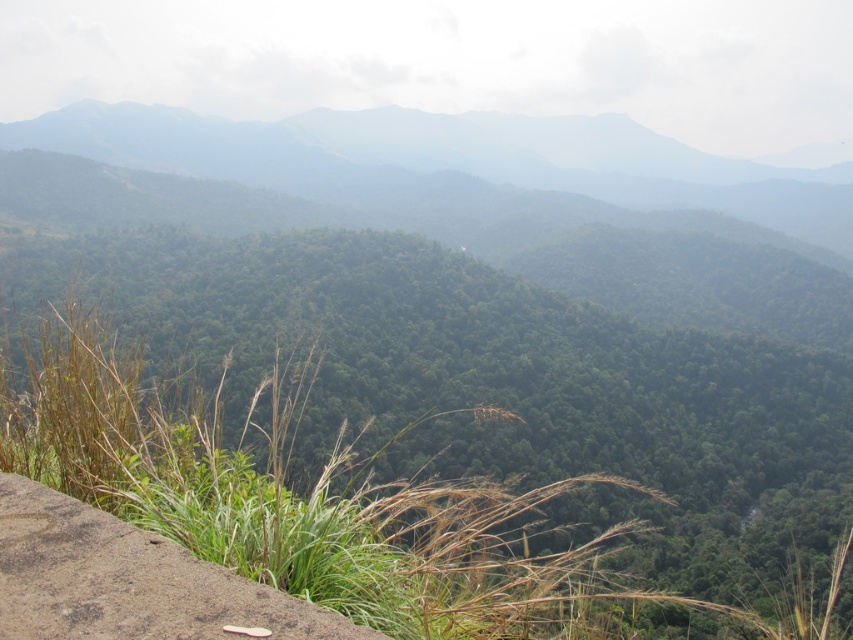
Question: Is green leafy grass at lower left closer to camera compared to green leafy forest at center?

Choices:
 (A) no
 (B) yes

Answer: (B)

Question: Can you confirm if green leafy forest at center is positioned above brown rough stone ledge at lower left?

Choices:
 (A) yes
 (B) no

Answer: (A)

Question: Among these objects, which one is farthest from the camera?

Choices:
 (A) green leafy grass at lower left
 (B) green leafy forest at center

Answer: (B)

Question: Can you confirm if green leafy grass at lower left is positioned to the left of brown rough stone ledge at lower left?

Choices:
 (A) yes
 (B) no

Answer: (A)

Question: Among these points, which one is farthest from the camera?

Choices:
 (A) (84, 566)
 (B) (627, 173)
 (C) (482, 342)

Answer: (B)

Question: Among these points, which one is nearest to the camera?

Choices:
 (A) (772, 512)
 (B) (366, 138)

Answer: (A)